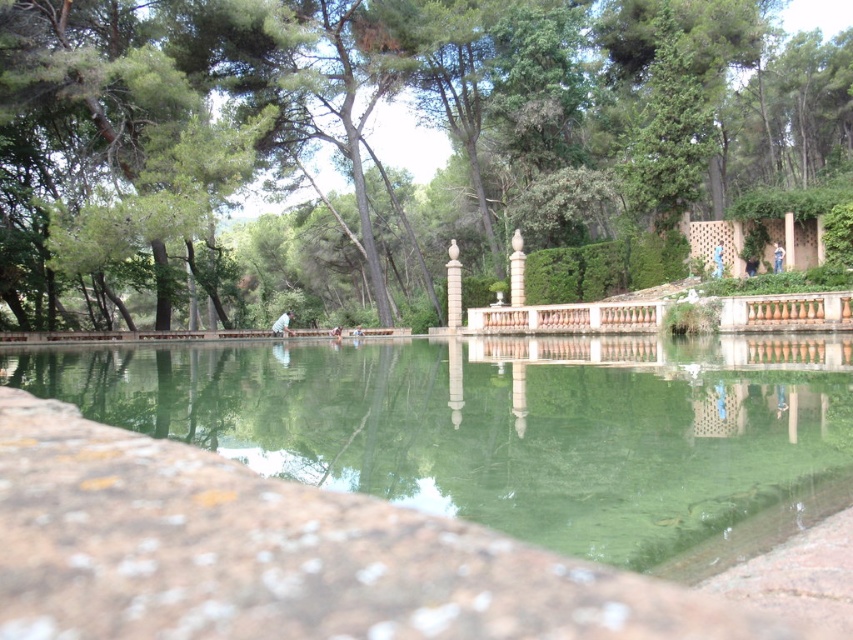
Is green leafy tree at upper center shorter than white marble pillar at center?

Incorrect, green leafy tree at upper center's height does not fall short of white marble pillar at center's.

Is point (534, 61) closer to camera compared to point (447, 282)?

Yes.

Where is `green leafy tree at upper center`? The height and width of the screenshot is (640, 853). green leafy tree at upper center is located at coordinates (376, 152).

Who is shorter, green stone pool at center or white marble pillar at center?

Standing shorter between the two is green stone pool at center.

Can you confirm if green stone pool at center is positioned to the left of white marble pillar at center?

Yes, green stone pool at center is to the left of white marble pillar at center.

Find the location of `green stone pool at center`. green stone pool at center is located at coordinates (511, 429).

You are a GUI agent. You are given a task and a screenshot of the screen. Output one action in this format:
    pyautogui.click(x=<x>, y=<y>)
    Task: Click on the green stone pool at center
    Image resolution: width=853 pixels, height=640 pixels.
    Given the screenshot: What is the action you would take?
    pyautogui.click(x=511, y=429)

Which of these two, green leafy tree at upper center or green stone pool at center, stands shorter?

green stone pool at center is shorter.

Is green leafy tree at upper center further to the viewer compared to green stone pool at center?

Yes.

Is point (795, 116) farther from camera compared to point (622, 561)?

Yes, it is behind point (622, 561).

The height and width of the screenshot is (640, 853). What are the coordinates of `green leafy tree at upper center` in the screenshot? It's located at (376, 152).